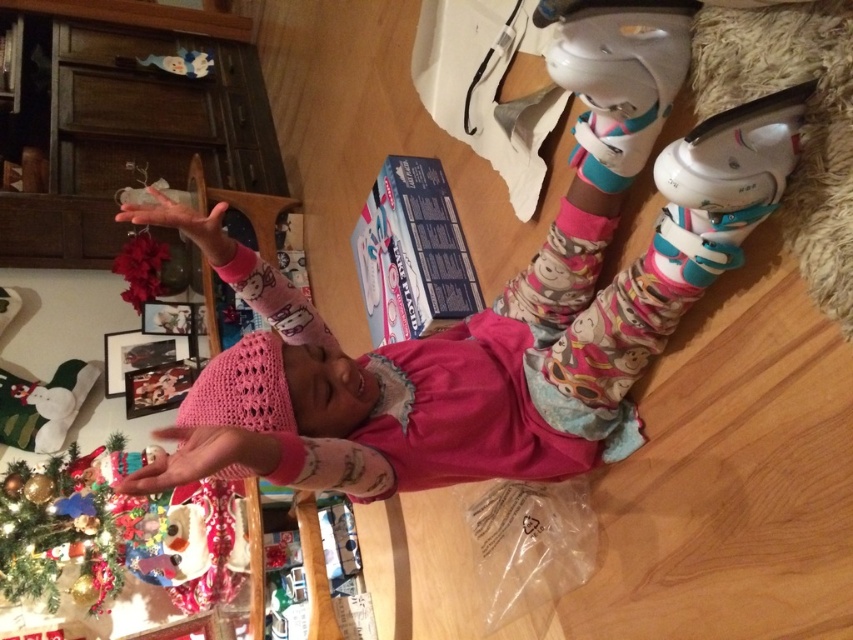
You are a parent looking for your child who is wearing a pink knitted hat at upper center and a pink knitted sock at center. You see both items in the image. Which one is nearer to you?

The pink knitted hat at upper center is closer to the viewer than the pink knitted sock at center.

You are a parent looking for your child who is wearing a pink knitted hat at upper center and pink knitted sock at center. According to the scene, where would you find the child?

The child is lying on the floor near the fluffy light colored rug. The pink knitted hat at upper center is above the pink knitted sock at center, indicating the hat is positioned higher up, possibly on the child or nearby, while the sock is at the center, likely on the child.

You are standing at the entrance of the room and want to place a gift under the green matte christmas tree at lower left. Based on the coordinates provided, is the tree positioned near the left wall or the right wall of the room?

The green matte christmas tree at lower left is located at point (61, 529), which indicates it is near the left wall of the room since the x coordinate is closer to 0.8, but wait the coordinate system might be different. Hmm, maybe I need to clarify the coordinate system first. Typically, in some systems, the origin is at the bottom left, so x increases to the right and y increases upward. If that is the case, then x 0.827 would be closer to the right side. But the object label says lower left, so maybe